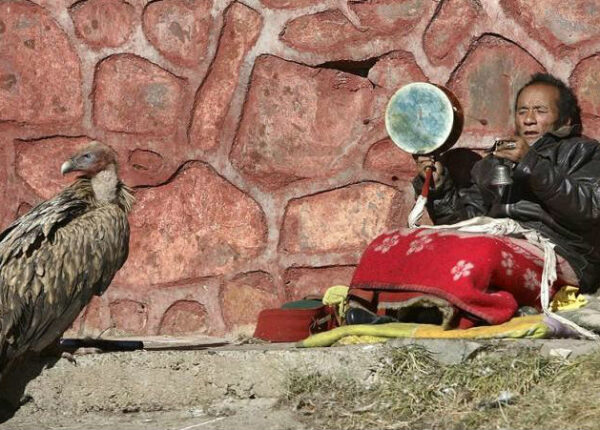
The image size is (600, 430). Find the location of `red blanket`. red blanket is located at coordinates (436, 273), (390, 266).